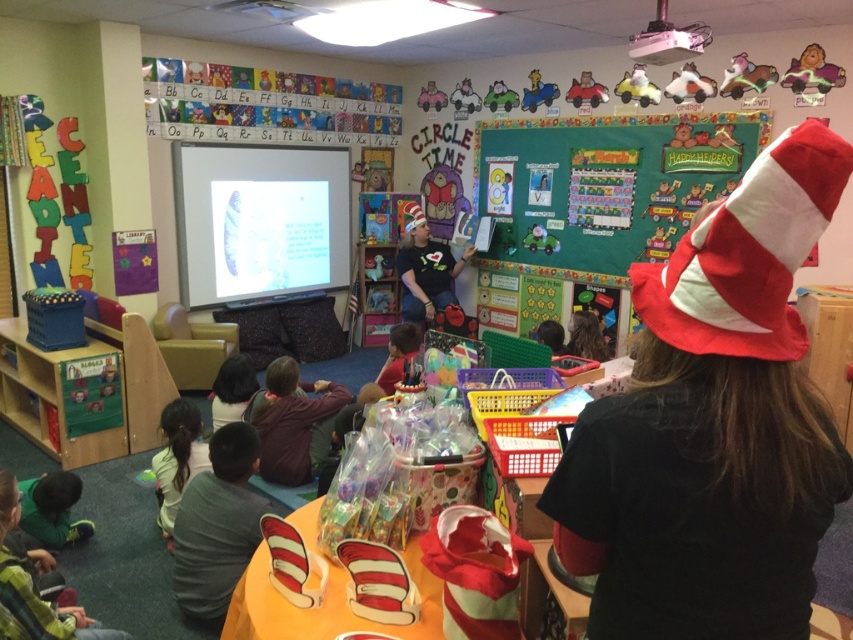
Which is in front, point (560, 211) or point (44, 614)?

Positioned in front is point (44, 614).

Is point (666, 188) farther from camera compared to point (24, 609)?

Yes, it is behind point (24, 609).

Image resolution: width=853 pixels, height=640 pixels. What are the coordinates of `green matte bulletin board at upper center` in the screenshot? It's located at (606, 182).

Is red velvet hat at upper right in front of red velvet hat at upper center?

Yes, it is in front of red velvet hat at upper center.

Who is positioned more to the right, red velvet hat at upper right or red velvet hat at upper center?

red velvet hat at upper right is more to the right.

Is point (793, 225) positioned behind point (410, 230)?

No, (793, 225) is in front of (410, 230).

Where is `red velvet hat at upper right`? The width and height of the screenshot is (853, 640). red velvet hat at upper right is located at coordinates (747, 253).

Is point (711, 129) positioned before point (277, 426)?

No.

Can you confirm if green matte bulletin board at upper center is smaller than dark brown sweater at lower left?

Incorrect, green matte bulletin board at upper center is not smaller in size than dark brown sweater at lower left.

The width and height of the screenshot is (853, 640). In order to click on green matte bulletin board at upper center in this screenshot , I will do `click(606, 182)`.

I want to click on green matte bulletin board at upper center, so [606, 182].